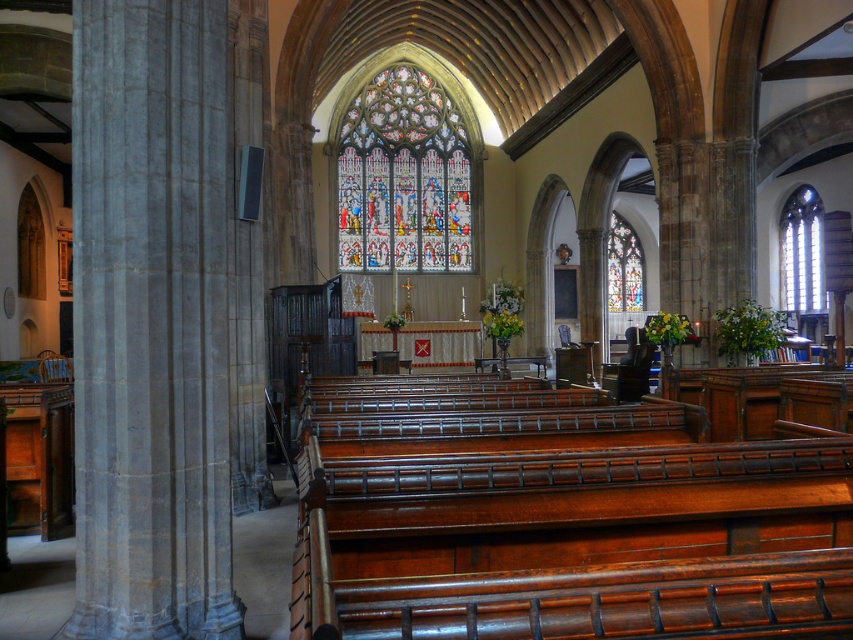
What do you see at coordinates (403, 177) in the screenshot? The width and height of the screenshot is (853, 640). I see `stained glass at center` at bounding box center [403, 177].

Between stained glass at center and stained glass window at center, which one is positioned higher?

stained glass at center is above.

Locate an element on the screen. The image size is (853, 640). stained glass at center is located at coordinates (403, 177).

Find the location of `stained glass at center`. stained glass at center is located at coordinates (403, 177).

In the scene shown: Can you confirm if clear glass window at right is positioned below stained glass window at center?

Actually, clear glass window at right is above stained glass window at center.

Does clear glass window at right have a lesser width compared to stained glass window at center?

Yes, clear glass window at right is thinner than stained glass window at center.

Locate an element on the screen. This screenshot has height=640, width=853. clear glass window at right is located at coordinates (801, 252).

Between gray stone column at left and clear glass window at right, which one is positioned higher?

clear glass window at right

Does point (151, 432) lie behind point (781, 278)?

No, it is not.

Does point (91, 388) come closer to viewer compared to point (790, 204)?

Yes, it is in front of point (790, 204).

You are a GUI agent. You are given a task and a screenshot of the screen. Output one action in this format:
    pyautogui.click(x=<x>, y=<y>)
    Task: Click on the gray stone column at left
    
    Given the screenshot: What is the action you would take?
    pyautogui.click(x=151, y=321)